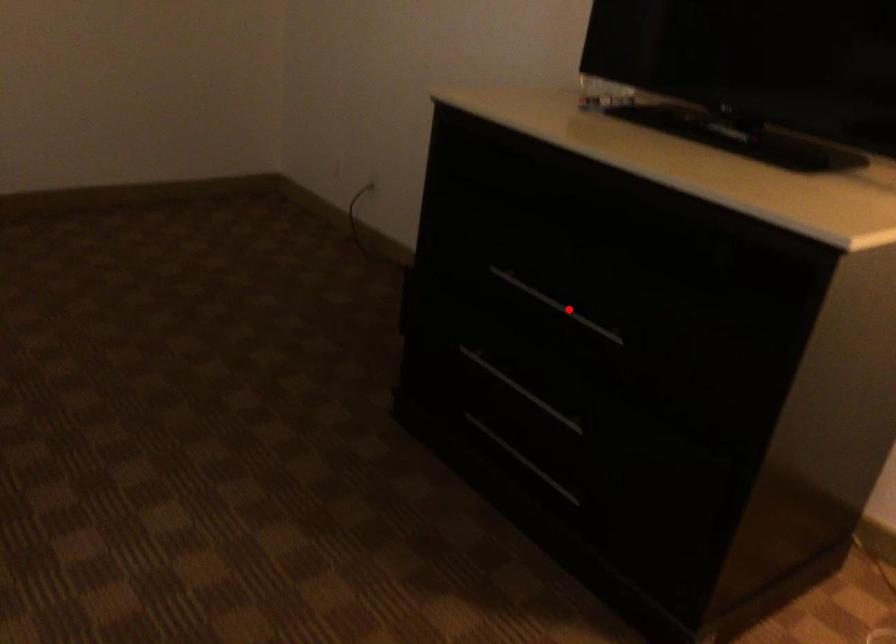
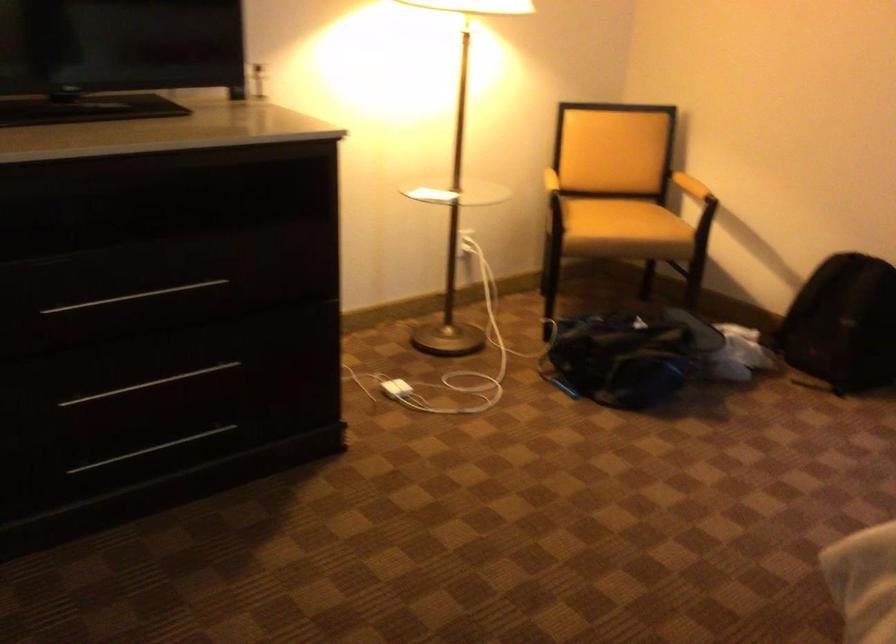
Question: I am providing you with two images of the same scene from different viewpoints. A red point is marked on the first image. Is the red point's position out of view in image 2?

Choices:
 (A) Yes
 (B) No

Answer: (B)